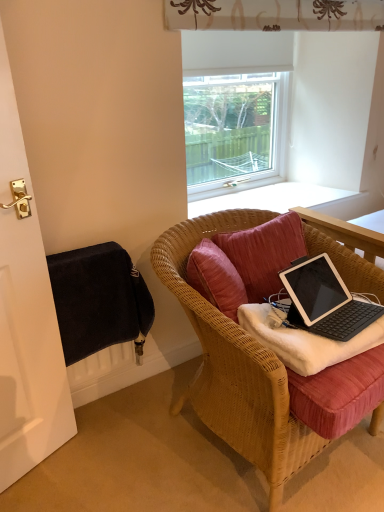
Question: From the image's perspective, is black matte laptop at center located above or below transparent glass window at upper center?

Choices:
 (A) below
 (B) above

Answer: (A)

Question: In the image, is black matte laptop at center on the left side or the right side of transparent glass window at upper center?

Choices:
 (A) left
 (B) right

Answer: (B)

Question: Which is nearer to the white soft blanket at center?

Choices:
 (A) black matte laptop at center
 (B) velvet-like pink pillow at center
 (C) black fabric radiator at lower left
 (D) woven wood chair at center
 (E) transparent glass window at upper center

Answer: (A)

Question: Considering the real-world distances, which object is closest to the woven wood chair at center?

Choices:
 (A) transparent glass window at upper center
 (B) black fabric at left
 (C) black fabric radiator at lower left
 (D) white soft blanket at center
 (E) black matte laptop at center

Answer: (D)